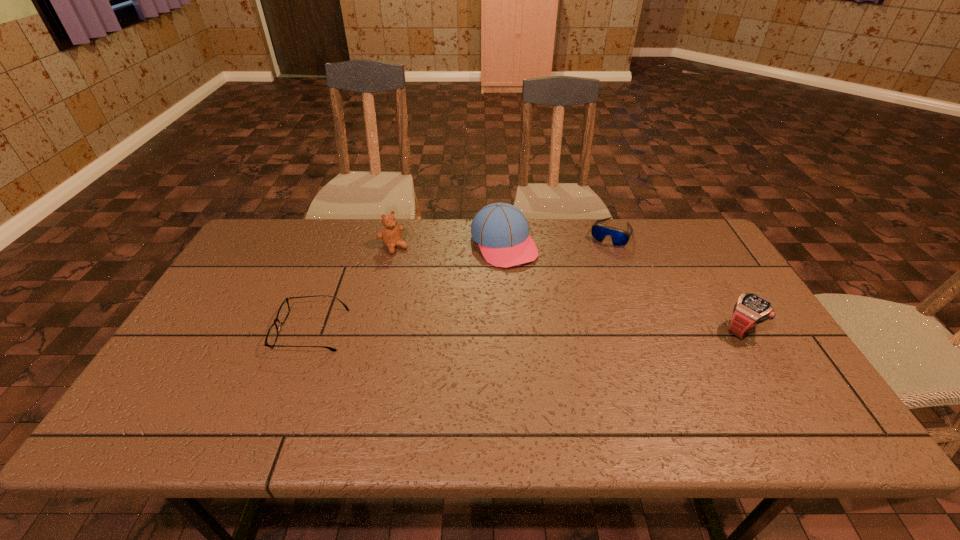
Find the location of `free space located on the front-facing side of the shortest object`. free space located on the front-facing side of the shortest object is located at coordinates (217, 330).

The width and height of the screenshot is (960, 540). I want to click on vacant region located 0.340m on the left of the watch, so click(x=590, y=329).

Identify the location of vacant position located 0.170m on the face of the fourth object from right to left. The width and height of the screenshot is (960, 540). (427, 284).

At what (x,y) coordinates should I click in order to perform the action: click on free spot located on the face of the fourth object from right to left. Please return your answer as a coordinate pair (x, y). This screenshot has height=540, width=960. Looking at the image, I should click on (417, 273).

This screenshot has height=540, width=960. What are the coordinates of `vacant space located on the face of the fourth object from right to left` in the screenshot? It's located at (454, 314).

You are a GUI agent. You are given a task and a screenshot of the screen. Output one action in this format:
    pyautogui.click(x=<x>, y=<y>)
    Task: Click on the free space located 0.190m on the front-facing side of the baseball cap
    Image resolution: width=960 pixels, height=540 pixels.
    Given the screenshot: What is the action you would take?
    pyautogui.click(x=547, y=310)

Identify the location of blank space located 0.270m on the front-facing side of the baseball cap. The image size is (960, 540). (561, 330).

Locate an element on the screen. This screenshot has height=540, width=960. free spot located 0.160m on the front-facing side of the baseball cap is located at coordinates [x=541, y=303].

The image size is (960, 540). Identify the location of vacant area situated 0.270m on the front-facing side of the fourth object from left to right. (579, 297).

Identify the location of free space located on the front-facing side of the fourth object from left to right. (572, 310).